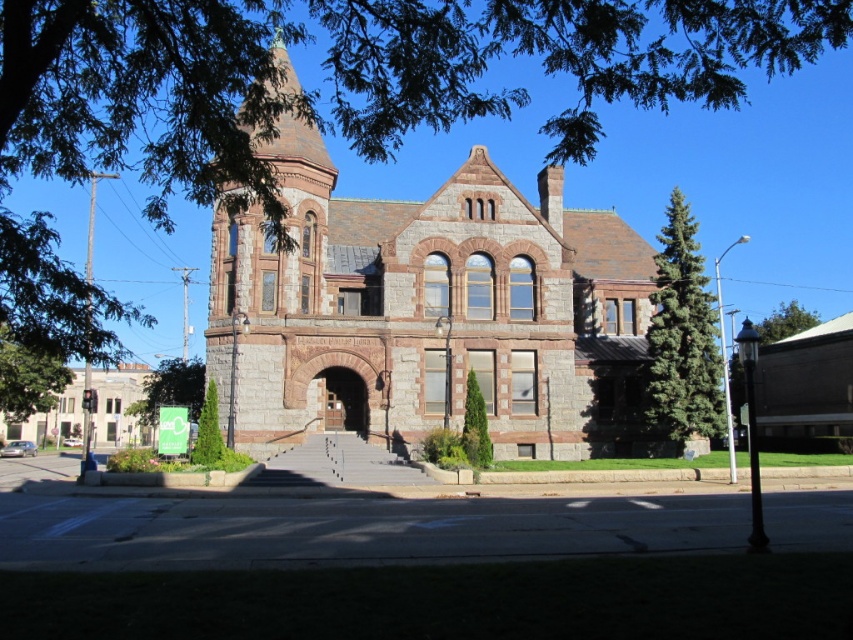
Is green leafy tree at left positioned behind green textured hedge at lower left?

No, green leafy tree at left is closer to the viewer.

Is green leafy tree at left smaller than green textured hedge at lower left?

No, green leafy tree at left is not smaller than green textured hedge at lower left.

Which is behind, point (12, 410) or point (209, 452)?

The point (12, 410) is more distant.

This screenshot has width=853, height=640. I want to click on green leafy tree at left, so coord(28,378).

Is green leafy tree at lower left shorter than green leafy tree at upper right?

In fact, green leafy tree at lower left may be taller than green leafy tree at upper right.

Who is more distant from viewer, (165, 380) or (779, 316)?

The point (779, 316) is behind.

You are a GUI agent. You are given a task and a screenshot of the screen. Output one action in this format:
    pyautogui.click(x=<x>, y=<y>)
    Task: Click on the green leafy tree at lower left
    The height and width of the screenshot is (640, 853).
    Given the screenshot: What is the action you would take?
    pyautogui.click(x=171, y=388)

Can you confirm if green fir tree at right is positioned to the right of green textured tree at center?

Correct, you'll find green fir tree at right to the right of green textured tree at center.

Is point (692, 371) closer to viewer compared to point (469, 436)?

No, (692, 371) is further to viewer.

Locate an element on the screen. The image size is (853, 640). green fir tree at right is located at coordinates (x=682, y=336).